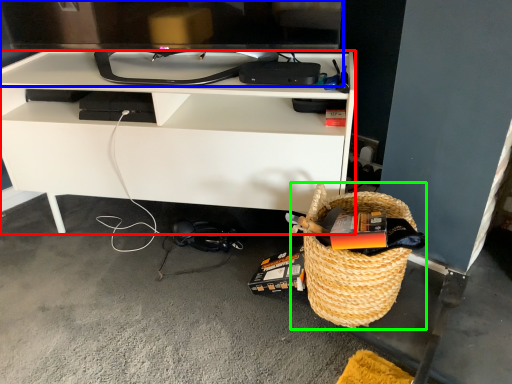
Question: Estimate the real-world distances between objects in this image. Which object is farther from desk (highlighted by a red box), television (highlighted by a blue box) or picnic basket (highlighted by a green box)?

Choices:
 (A) television
 (B) picnic basket

Answer: (B)